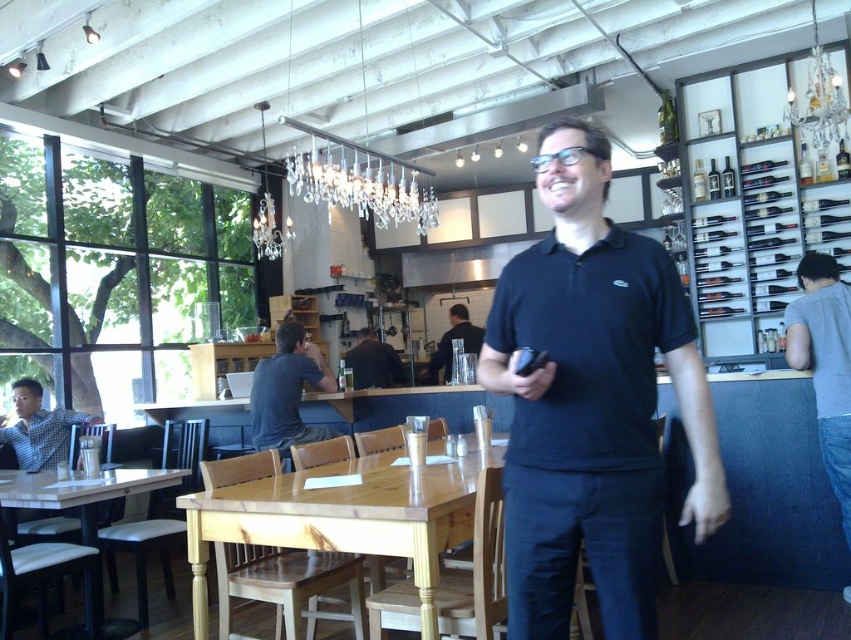
You are a customer sitting at the natural wood table at center in the cozy cafe. You want to look up at the crystal glass chandelier at upper center. In which direction should you turn your head?

The natural wood table at center is to the right of the crystal glass chandelier at upper center, so you should turn your head to the left to look up at the chandelier.

You are standing at the entrance of the cozy cafe and notice a person wearing a dark gray shirt at center. If you want to approach them directly, which direction should you head towards from your current position?

The dark gray shirt at center is located at point 0.613 on the x and 0.338 on the y coordinates, so you should head towards the center of the cafe to reach them.